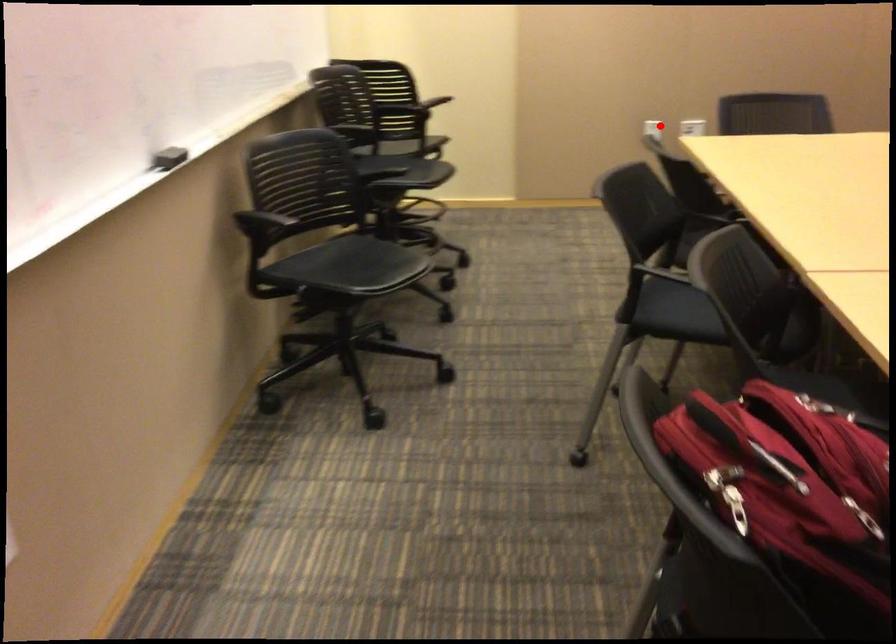
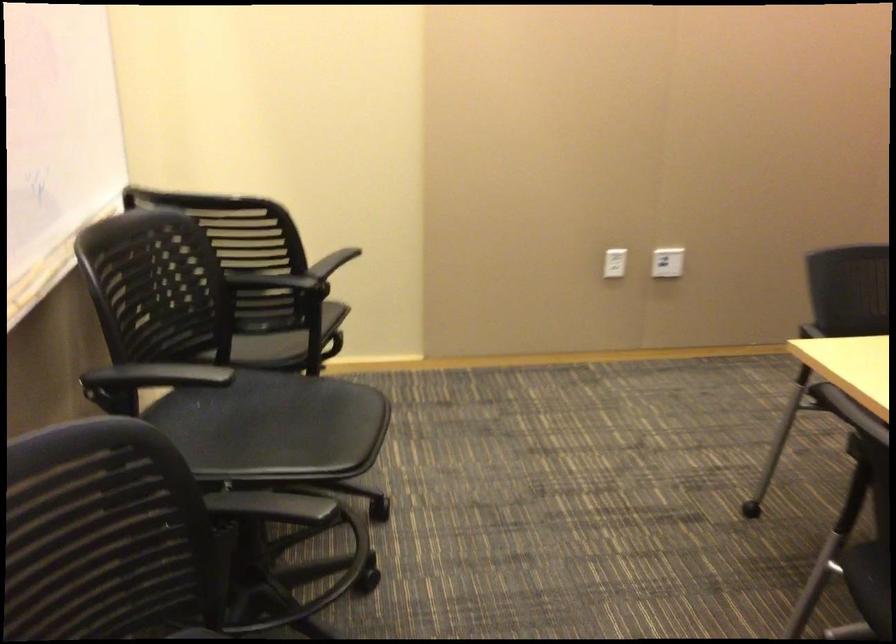
The point at the highlighted location is marked in the first image. Where is the corresponding point in the second image?

(615, 263)